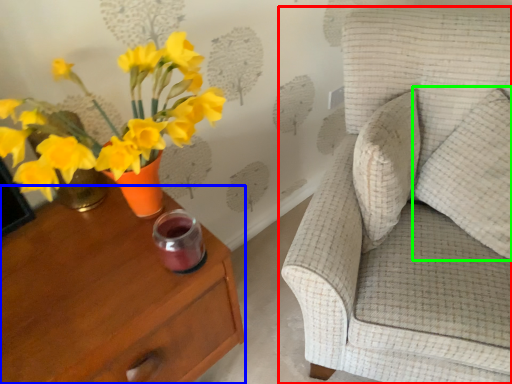
Question: Which is farther away from chair (highlighted by a red box)? nightstand (highlighted by a blue box) or pillow (highlighted by a green box)?

Choices:
 (A) nightstand
 (B) pillow

Answer: (A)